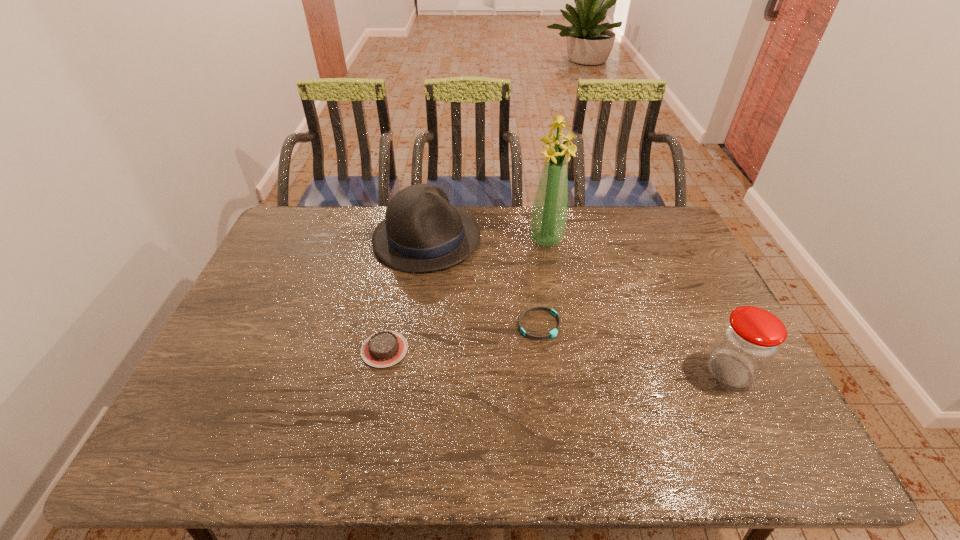
This screenshot has width=960, height=540. In order to click on object that is the closest to the bowler hat in this screenshot , I will do `click(548, 221)`.